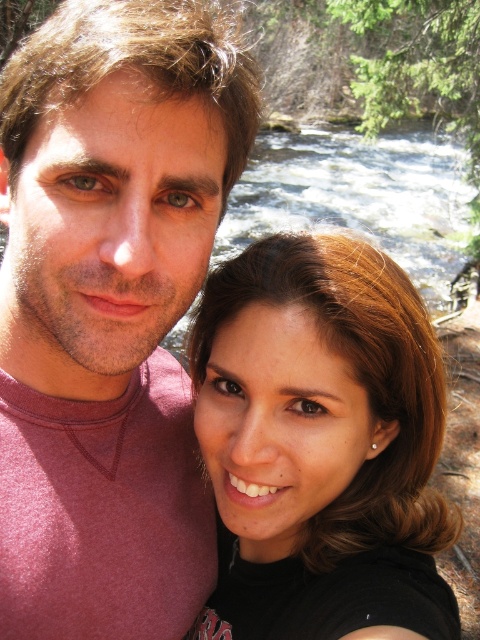
Question: Which point is farther to the camera?

Choices:
 (A) (108, 532)
 (B) (374, 524)

Answer: (B)

Question: Is matte pink shirt at center above matte black hair at center?

Choices:
 (A) no
 (B) yes

Answer: (B)

Question: Can you confirm if matte pink shirt at center is positioned below matte black hair at center?

Choices:
 (A) no
 (B) yes

Answer: (A)

Question: Which point appears closest to the camera in this image?

Choices:
 (A) (63, 540)
 (B) (408, 570)

Answer: (B)

Question: Which point is closer to the camera?

Choices:
 (A) matte black hair at center
 (B) matte pink shirt at center

Answer: (B)

Question: Is the position of matte pink shirt at center more distant than that of matte black hair at center?

Choices:
 (A) no
 (B) yes

Answer: (A)